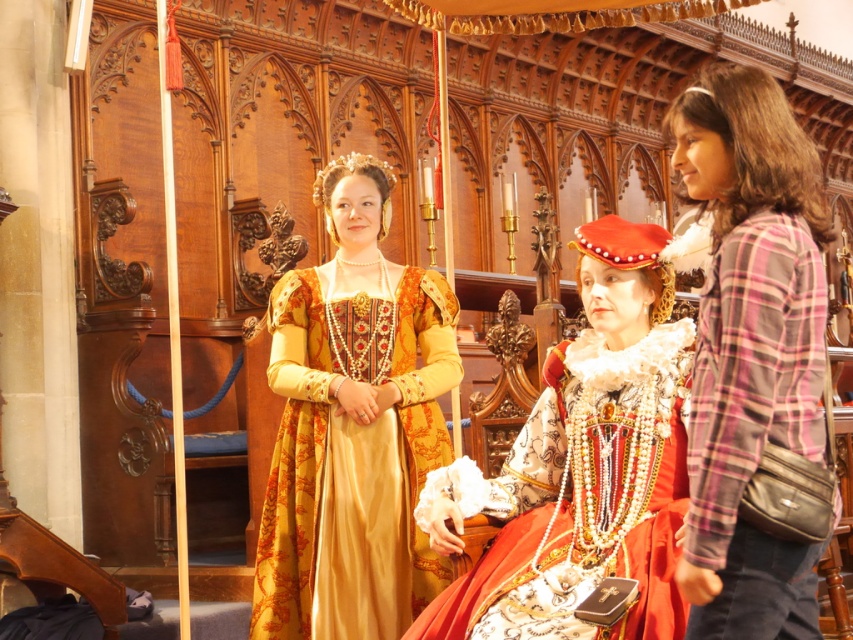
Who is taller, golden silk gown at center or matte red velvet dress at center?

golden silk gown at center is taller.

Does point (303, 401) come closer to viewer compared to point (611, 531)?

No, it is not.

Does point (305, 346) come farther from viewer compared to point (573, 445)?

That is True.

Image resolution: width=853 pixels, height=640 pixels. Identify the location of golden silk gown at center. (352, 426).

Does plaid fabric shirt at right appear on the right side of matte red velvet dress at center?

Correct, you'll find plaid fabric shirt at right to the right of matte red velvet dress at center.

Which is behind, point (796, 605) or point (453, 541)?

Point (453, 541)

I want to click on plaid fabric shirt at right, so click(x=750, y=348).

Which is in front, point (300, 352) or point (718, 120)?

Positioned in front is point (718, 120).

Is golden silk gown at center shorter than plaid fabric shirt at right?

Incorrect, golden silk gown at center's height does not fall short of plaid fabric shirt at right's.

Describe the element at coordinates (352, 426) in the screenshot. I see `golden silk gown at center` at that location.

The height and width of the screenshot is (640, 853). What are the coordinates of `golden silk gown at center` in the screenshot? It's located at (352, 426).